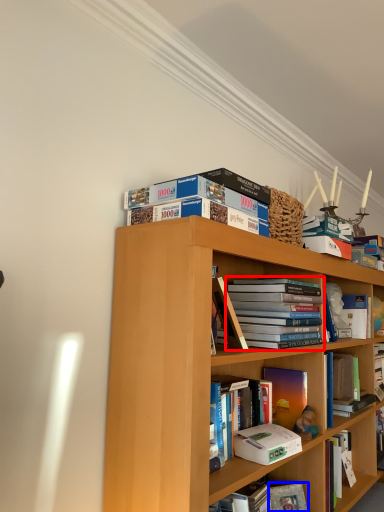
Question: Which point is further to the camera, book (highlighted by a red box) or paperback book (highlighted by a blue box)?

Choices:
 (A) book
 (B) paperback book

Answer: (B)